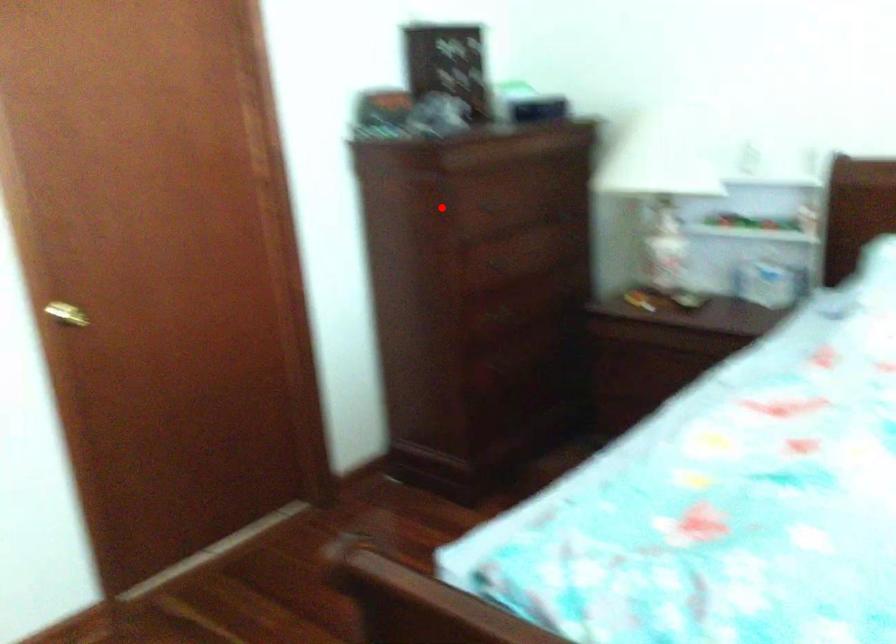
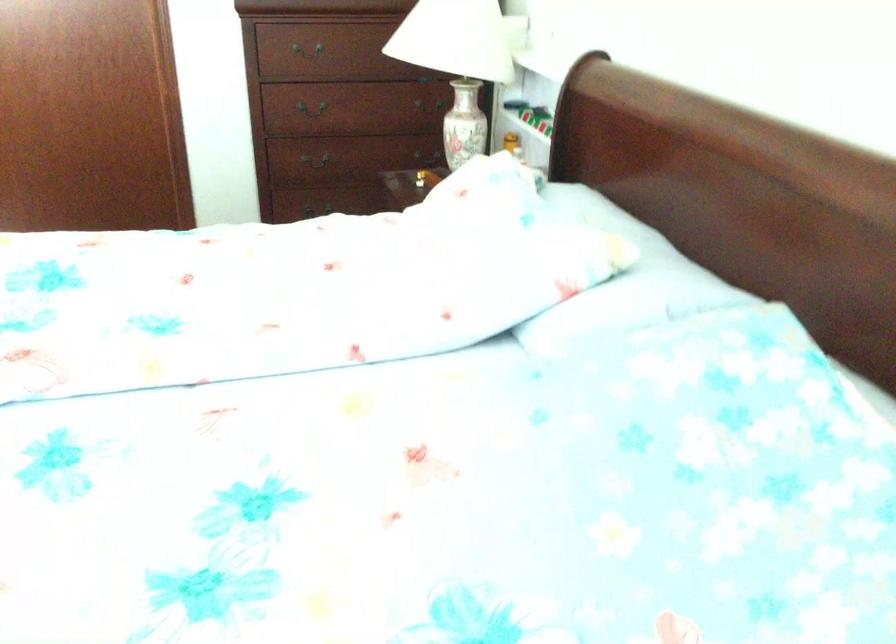
Question: I am providing you with two images of the same scene from different viewpoints. A red point is shown in image1. For the corresponding object point in image2, is it positioned nearer or farther from the camera?

Choices:
 (A) Nearer
 (B) Farther

Answer: (B)